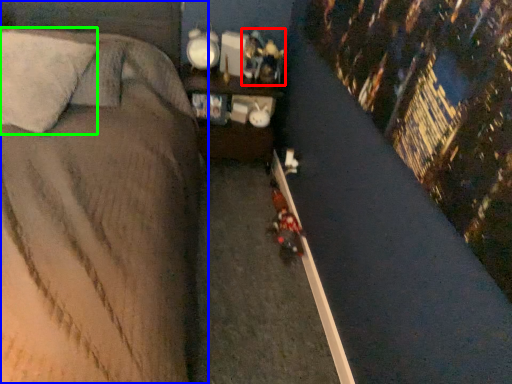
Question: Which is nearer to the toy (highlighted by a red box)? bed (highlighted by a blue box) or pillow (highlighted by a green box).

Choices:
 (A) bed
 (B) pillow

Answer: (A)